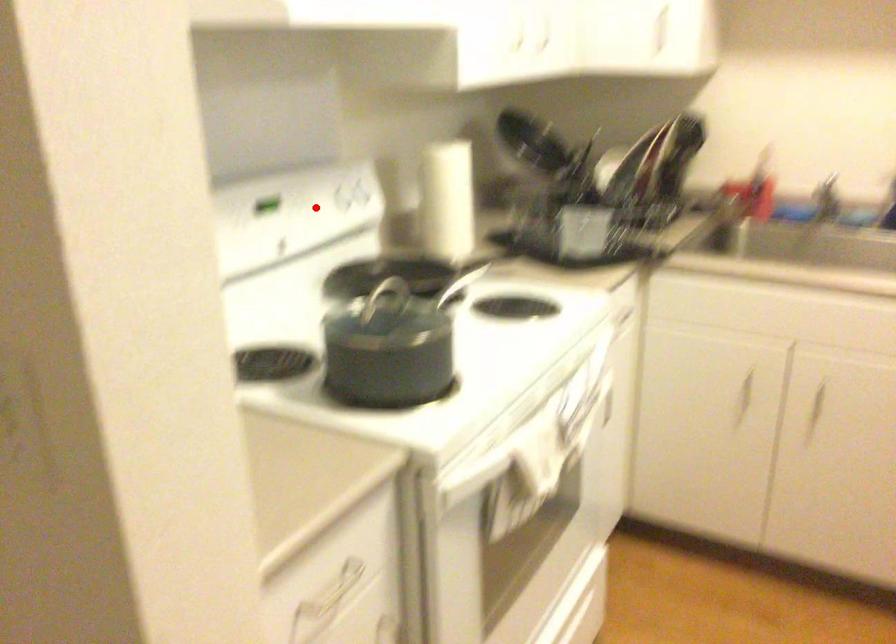
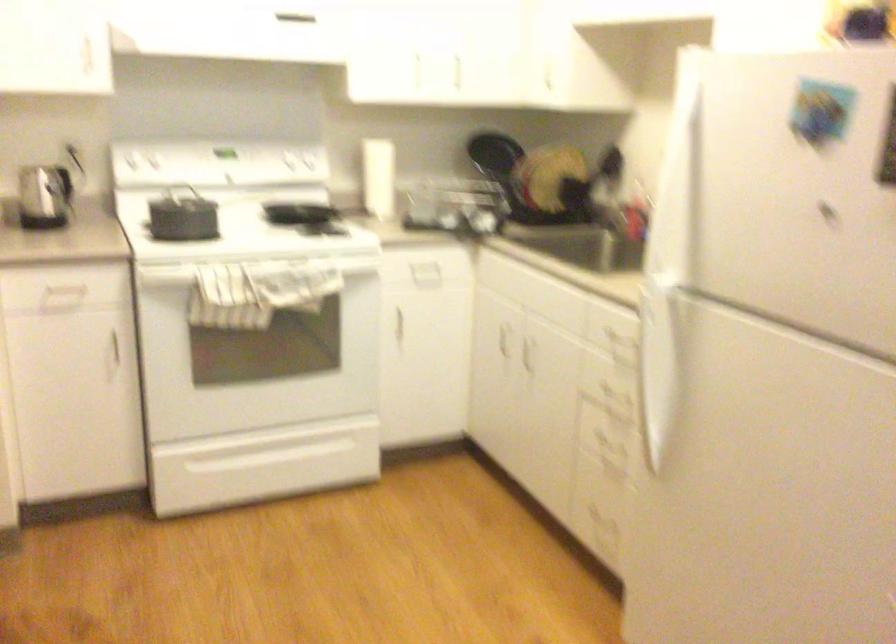
In the second image, find the point that corresponds to the highlighted location in the first image.

(283, 169)